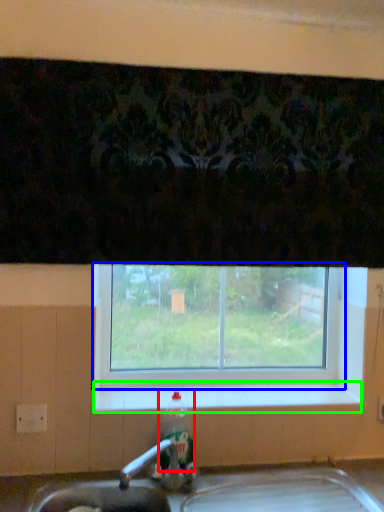
Question: Which is farther away from bottle (highlighted by a red box)? window (highlighted by a blue box) or window sill (highlighted by a green box)?

Choices:
 (A) window
 (B) window sill

Answer: (A)